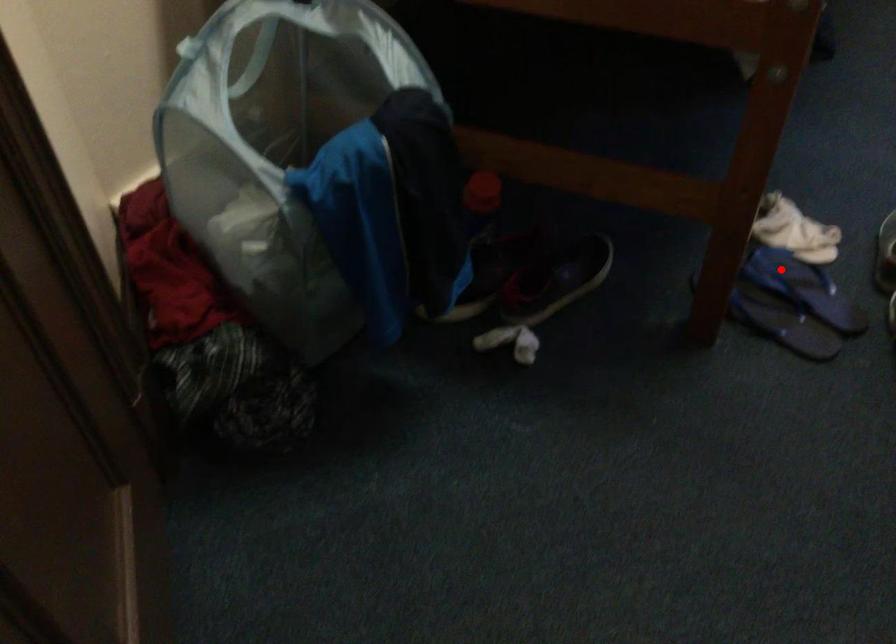
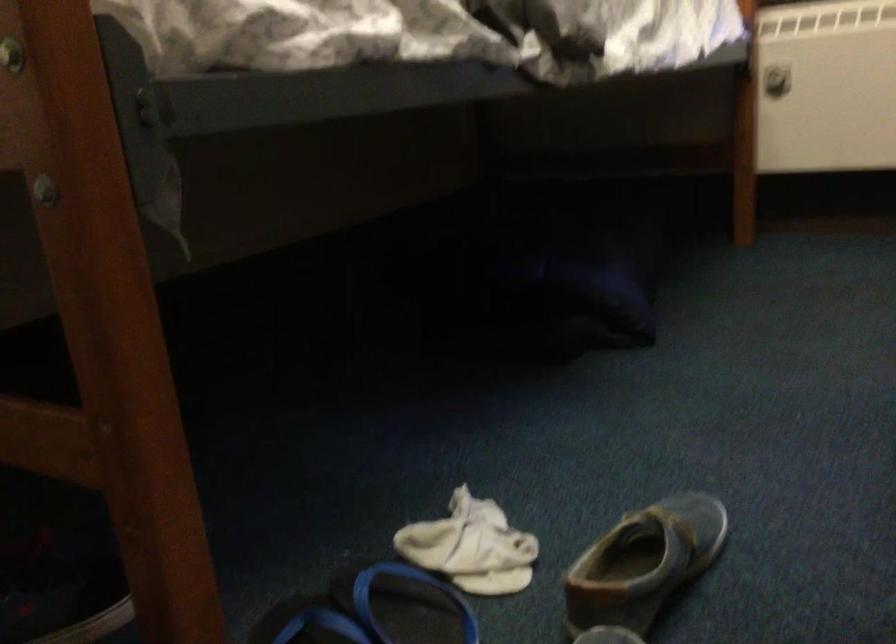
Locate, in the second image, the point that corresponds to the highlighted location in the first image.

(406, 605)